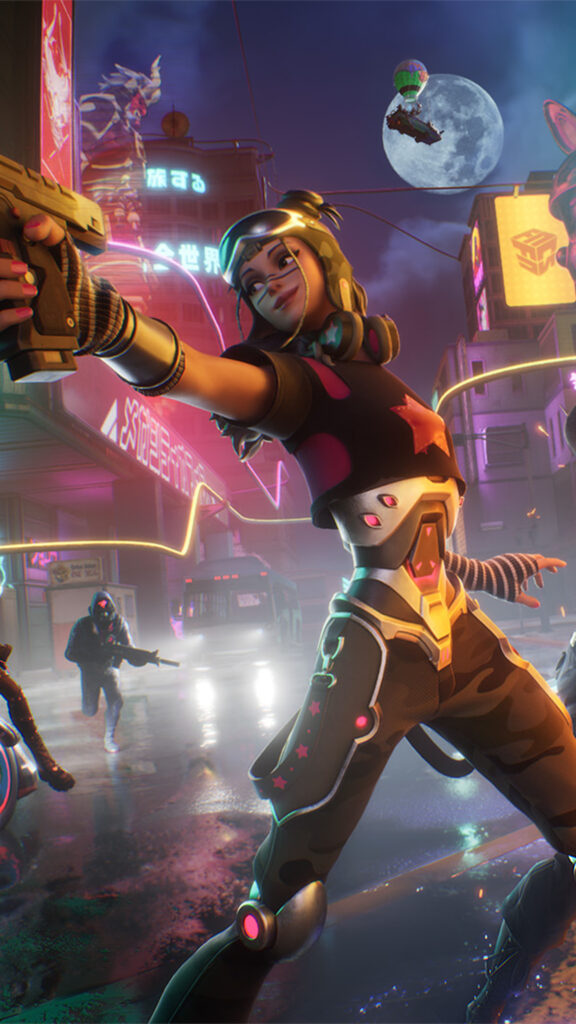
Identify the location of headphone cups. This screenshot has height=1024, width=576. (344, 330), (376, 334).